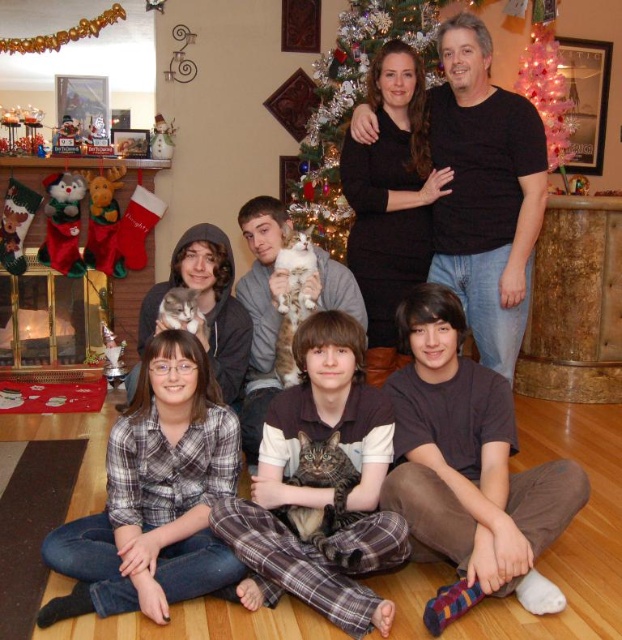
Is brown cotton shirt at lower right taller than green glittering christmas tree at upper center?

No, brown cotton shirt at lower right is not taller than green glittering christmas tree at upper center.

What do you see at coordinates (470, 461) in the screenshot? This screenshot has width=622, height=640. I see `brown cotton shirt at lower right` at bounding box center [470, 461].

Where is `brown cotton shirt at lower right`? The width and height of the screenshot is (622, 640). brown cotton shirt at lower right is located at coordinates 470,461.

Between striped fabric cat at center and pink glittering christmas tree at upper center, which one has more height?

With more height is pink glittering christmas tree at upper center.

Does striped fabric cat at center appear on the left side of pink glittering christmas tree at upper center?

Indeed, striped fabric cat at center is positioned on the left side of pink glittering christmas tree at upper center.

Who is more distant from viewer, (216,522) or (564,182)?

Positioned behind is point (564,182).

The image size is (622, 640). I want to click on striped fabric cat at center, so click(320, 486).

Can you confirm if brown cotton shirt at lower right is positioned below pink glittering christmas tree at upper center?

Correct, brown cotton shirt at lower right is located below pink glittering christmas tree at upper center.

Does brown cotton shirt at lower right have a greater height compared to pink glittering christmas tree at upper center?

In fact, brown cotton shirt at lower right may be shorter than pink glittering christmas tree at upper center.

Between point (473, 460) and point (545, 132), which one is positioned behind?

The point (545, 132) is behind.

Locate an element on the screen. brown cotton shirt at lower right is located at coordinates (470, 461).